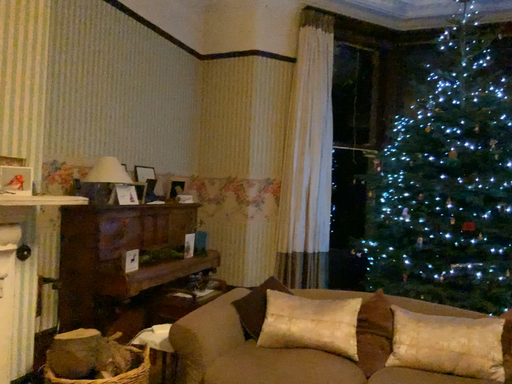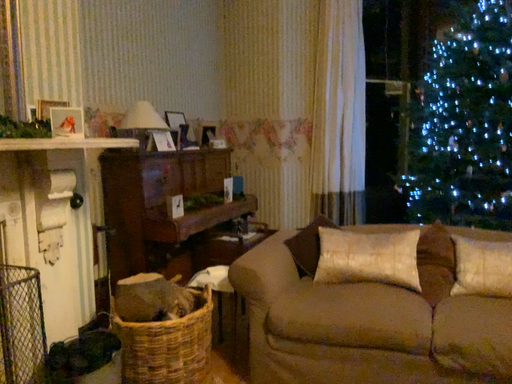
Question: How did the camera likely rotate when shooting the video?

Choices:
 (A) rotated downward
 (B) rotated upward

Answer: (A)